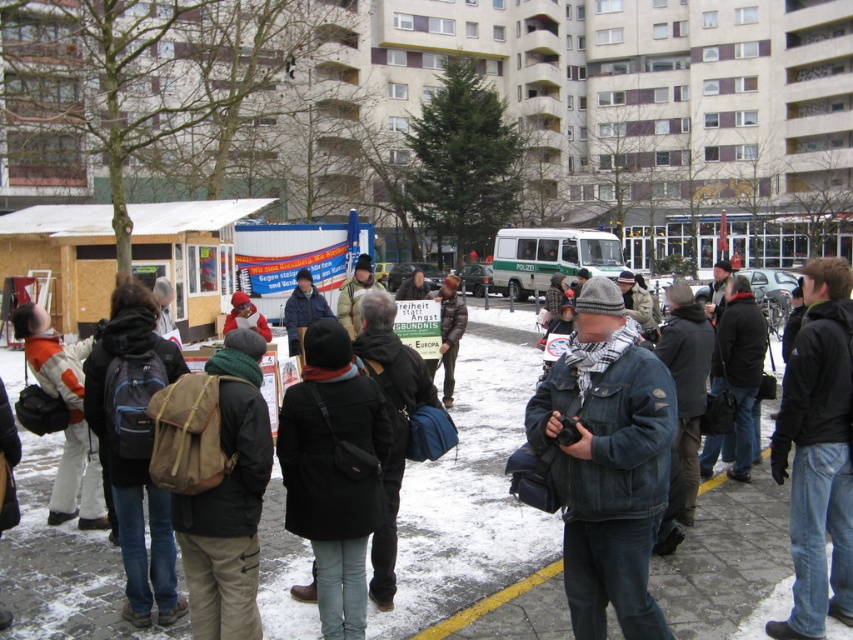
Question: Is denim jacket at center positioned before dark blue jeans at center?

Choices:
 (A) yes
 (B) no

Answer: (A)

Question: Which of the following is the closest to the observer?

Choices:
 (A) denim jacket at center
 (B) dark blue jeans at center

Answer: (A)

Question: Which of the following is the farthest from the observer?

Choices:
 (A) [612, 397]
 (B) [817, 388]

Answer: (B)

Question: Which point appears farthest from the camera in this image?

Choices:
 (A) (640, 579)
 (B) (819, 451)

Answer: (B)

Question: Does denim jacket at center have a larger size compared to dark blue jeans at center?

Choices:
 (A) no
 (B) yes

Answer: (A)

Question: Is denim jacket at center further to the viewer compared to dark blue jeans at center?

Choices:
 (A) yes
 (B) no

Answer: (B)